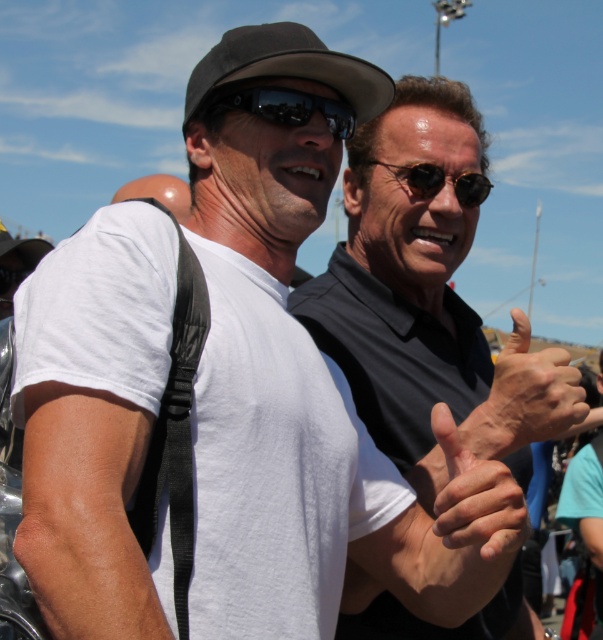
Is the position of black fabric baseball hat at upper center more distant than that of sunglasses at center?

Yes, it is behind sunglasses at center.

Where is `black fabric baseball hat at upper center`? The image size is (603, 640). black fabric baseball hat at upper center is located at coordinates (286, 67).

Does smooth skin hand at center lie behind matte black hand at center?

No, smooth skin hand at center is in front of matte black hand at center.

Describe the element at coordinates (531, 394) in the screenshot. This screenshot has height=640, width=603. I see `smooth skin hand at center` at that location.

Image resolution: width=603 pixels, height=640 pixels. What are the coordinates of `smooth skin hand at center` in the screenshot? It's located at (531, 394).

Is point (435, 404) in front of point (297, 104)?

Yes, point (435, 404) is in front of point (297, 104).

Is dry skin hand at center shorter than sunglasses at center?

No, dry skin hand at center is not shorter than sunglasses at center.

Which is behind, point (479, 461) or point (297, 93)?

The point (297, 93) is more distant.

I want to click on dry skin hand at center, so click(x=472, y=497).